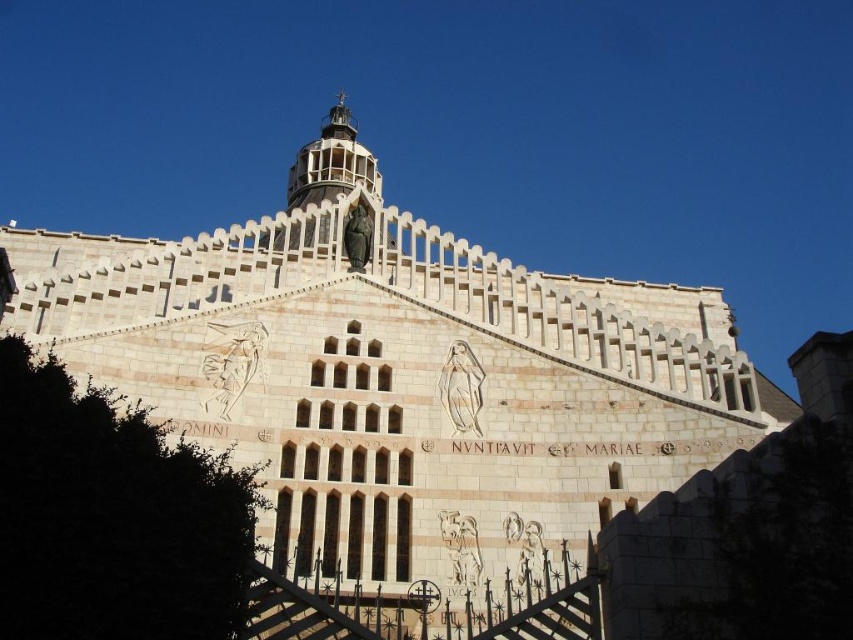
You are standing in front of the grand structure and notice the dark green leafy tree at lower left and the white lattice tower at upper center. Which object is closer to you from your current viewpoint?

The dark green leafy tree at lower left is closer to you because it is in front of the white lattice tower at upper center, which is further away.